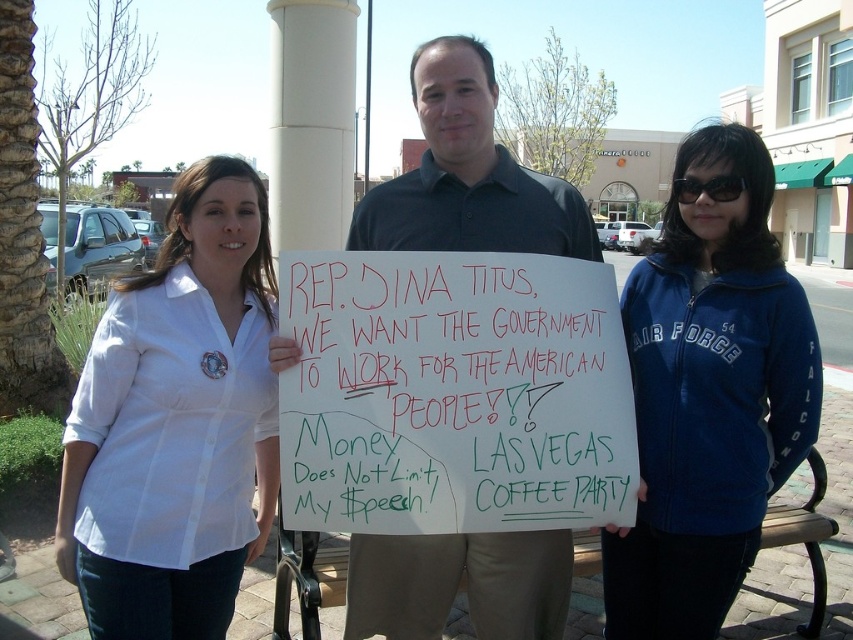
Between point (222, 228) and point (583, 212), which one is positioned behind?

The point (583, 212) is more distant.

Describe the element at coordinates (177, 422) in the screenshot. The image size is (853, 640). I see `white button-down shirt at left` at that location.

What do you see at coordinates (177, 422) in the screenshot? The width and height of the screenshot is (853, 640). I see `white button-down shirt at left` at bounding box center [177, 422].

You are a GUI agent. You are given a task and a screenshot of the screen. Output one action in this format:
    pyautogui.click(x=<x>, y=<y>)
    Task: Click on the white button-down shirt at left
    The height and width of the screenshot is (640, 853).
    Given the screenshot: What is the action you would take?
    pyautogui.click(x=177, y=422)

Which is above, blue fleece jacket at center or dark gray shirt at center?

dark gray shirt at center

Is point (672, 609) closer to viewer compared to point (421, 244)?

Yes, point (672, 609) is closer to viewer.

Between point (717, 614) and point (518, 609), which one is positioned in front?

Point (717, 614) is more forward.

Find the location of a particular element. blue fleece jacket at center is located at coordinates (709, 392).

Which is above, handwritten sign at center or white button-down shirt at left?

handwritten sign at center

Is handwritten sign at center to the right of white button-down shirt at left from the viewer's perspective?

Yes, handwritten sign at center is to the right of white button-down shirt at left.

Which is behind, point (430, 464) or point (184, 508)?

Point (430, 464)

Image resolution: width=853 pixels, height=640 pixels. I want to click on handwritten sign at center, so click(x=453, y=394).